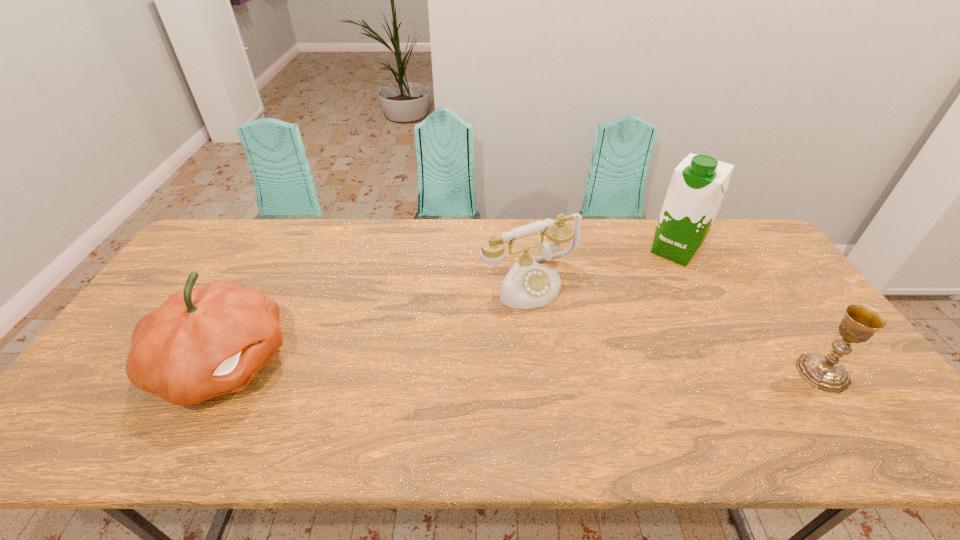
Identify the location of free space located 0.120m on the dial of the telephone. (580, 335).

Identify the location of vacant position located on the front-facing side of the tallest object. (656, 276).

Find the location of `vacant space located on the front-facing side of the tallest object`. vacant space located on the front-facing side of the tallest object is located at coordinates (656, 276).

Where is `vacant area located 0.290m on the front-facing side of the tallest object`? This screenshot has height=540, width=960. vacant area located 0.290m on the front-facing side of the tallest object is located at coordinates (626, 316).

This screenshot has height=540, width=960. Identify the location of telephone that is at the far edge. (528, 284).

The height and width of the screenshot is (540, 960). I want to click on soya milk at the far edge, so click(x=698, y=185).

Locate an element on the screen. The height and width of the screenshot is (540, 960). pumpkin at the near edge is located at coordinates (202, 342).

Where is `chalice that is at the near edge`? Image resolution: width=960 pixels, height=540 pixels. chalice that is at the near edge is located at coordinates (860, 322).

This screenshot has height=540, width=960. I want to click on object that is at the left edge, so click(202, 342).

I want to click on object at the right edge, so click(860, 322).